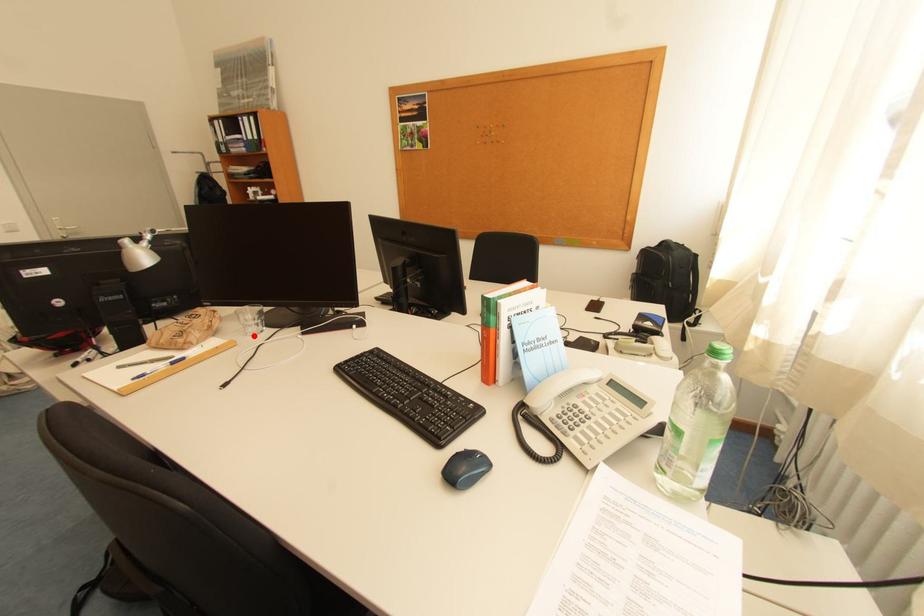
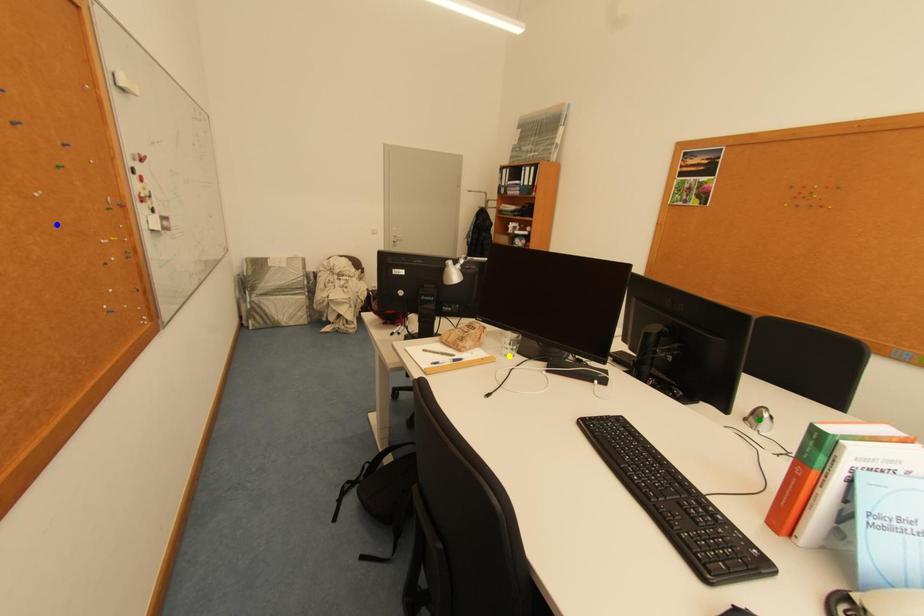
Question: I am providing you with two images of the same scene from different viewpoints. A red point is marked on the first image. You are given multiple points on the second image. Which spot in image 2 lines up with the point in image 1?

Choices:
 (A) green point
 (B) yellow point
 (C) blue point

Answer: (B)